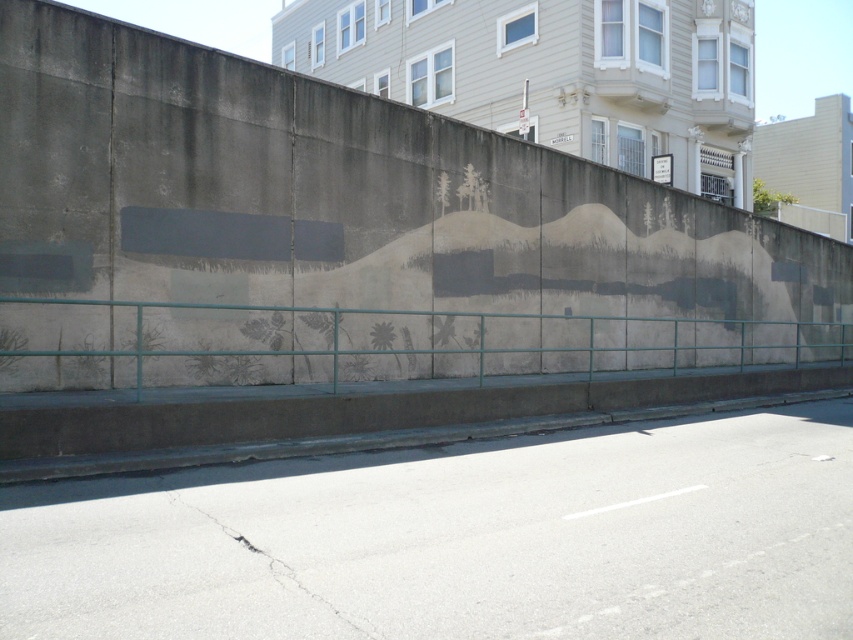
Question: Which object is positioned farthest from the concrete wall at center?

Choices:
 (A) gray asphalt pavement at lower center
 (B) teal metal fence at lower center

Answer: (A)

Question: Among these objects, which one is nearest to the camera?

Choices:
 (A) teal metal fence at lower center
 (B) concrete wall at center

Answer: (A)

Question: Can you confirm if concrete wall at center is positioned above gray asphalt pavement at lower center?

Choices:
 (A) yes
 (B) no

Answer: (A)

Question: Among these points, which one is nearest to the camera?

Choices:
 (A) (206, 490)
 (B) (99, 308)
 (C) (90, 276)

Answer: (A)

Question: Is concrete wall at center in front of gray asphalt pavement at lower center?

Choices:
 (A) no
 (B) yes

Answer: (A)

Question: Does concrete wall at center have a greater width compared to gray asphalt pavement at lower center?

Choices:
 (A) yes
 (B) no

Answer: (A)